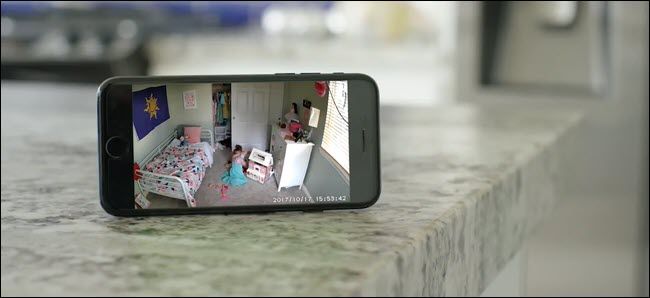
Where is `closet door`? The width and height of the screenshot is (650, 298). closet door is located at coordinates 257,105.